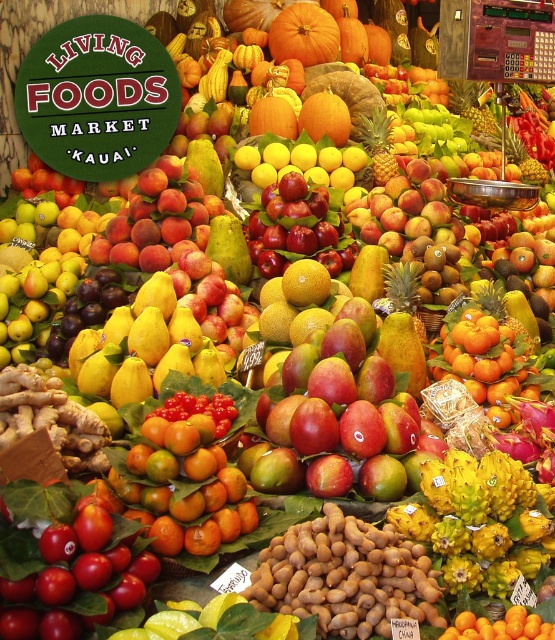
This screenshot has height=640, width=555. What do you see at coordinates (184, 484) in the screenshot?
I see `shiny orange tangerines at center` at bounding box center [184, 484].

In the scene shown: Is shiny orange tangerines at center bigger than shiny red apple at center?

No.

The width and height of the screenshot is (555, 640). In order to click on shiny orange tangerines at center in this screenshot , I will do `click(184, 484)`.

Is shiny orange tangerines at center closer to the viewer compared to shiny red apples at center?

Yes, it is in front of shiny red apples at center.

Who is more forward, (185, 422) or (309, 198)?

Positioned in front is point (185, 422).

Describe the element at coordinates (184, 484) in the screenshot. Image resolution: width=555 pixels, height=640 pixels. I see `shiny orange tangerines at center` at that location.

The image size is (555, 640). I want to click on shiny orange tangerines at center, so click(x=184, y=484).

Who is positioned more to the right, shiny red apples at center or shiny red apple at center?

shiny red apple at center is more to the right.

Can you confirm if shiny red apples at center is positioned above shiny red apple at center?

No, shiny red apples at center is not above shiny red apple at center.

You are a GUI agent. You are given a task and a screenshot of the screen. Output one action in this format:
    pyautogui.click(x=<x>, y=<y>)
    Task: Click on the shiny red apples at center
    
    Given the screenshot: What is the action you would take?
    pyautogui.click(x=296, y=227)